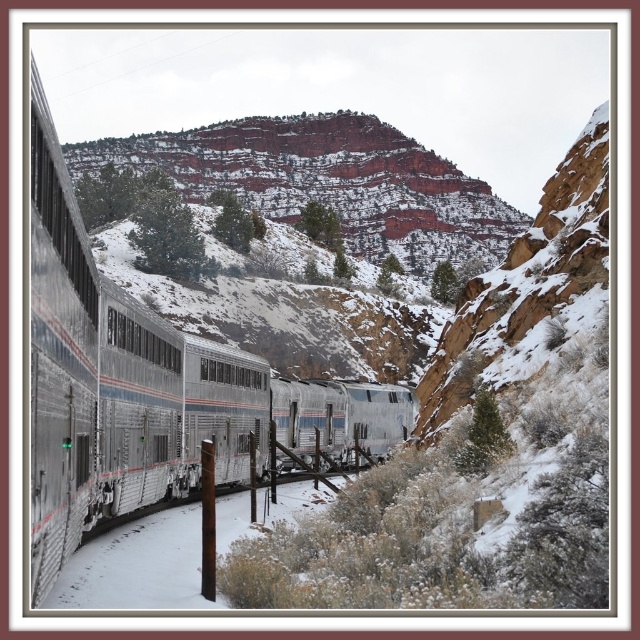
Question: Can you confirm if silver metallic train at left is positioned below reddish-brown rock formation at upper center?

Choices:
 (A) yes
 (B) no

Answer: (A)

Question: Does silver metallic train at left have a lesser width compared to reddish-brown rock formation at upper center?

Choices:
 (A) no
 (B) yes

Answer: (B)

Question: Is silver metallic train at left to the left of reddish-brown rock formation at upper center from the viewer's perspective?

Choices:
 (A) no
 (B) yes

Answer: (A)

Question: Which object appears farthest from the camera in this image?

Choices:
 (A) reddish-brown rock formation at upper center
 (B) silver metallic train at left

Answer: (A)

Question: Among these objects, which one is nearest to the camera?

Choices:
 (A) silver metallic train at left
 (B) reddish-brown rock formation at upper center

Answer: (A)